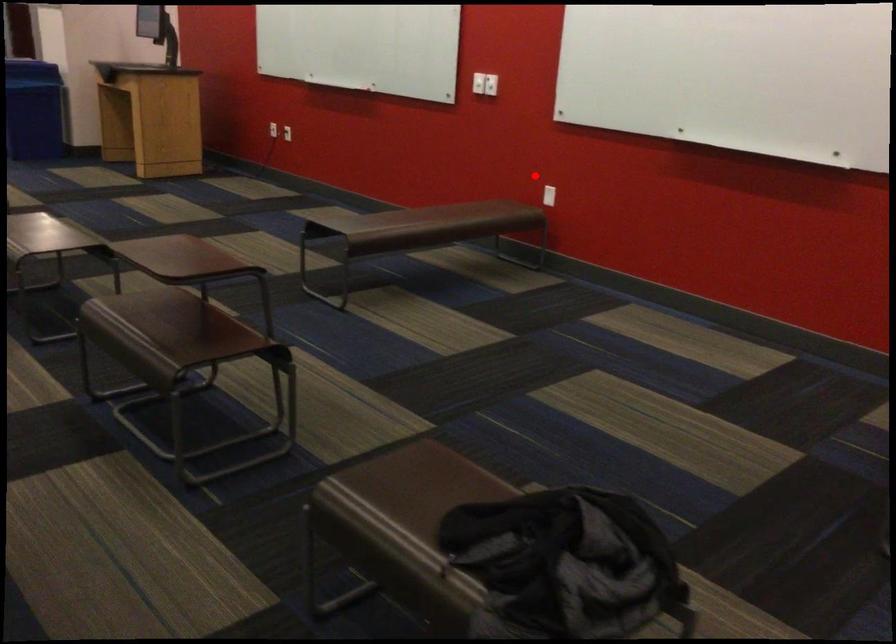
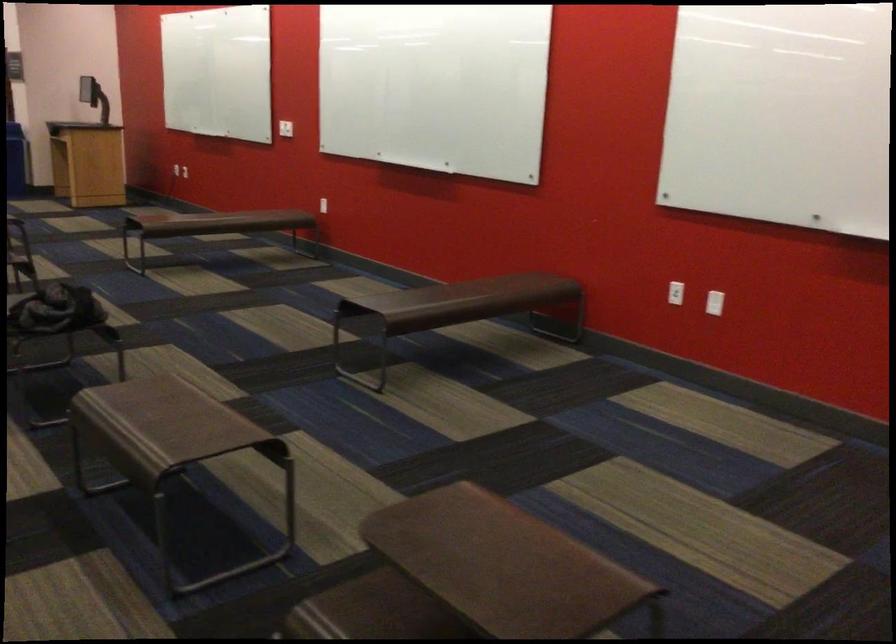
Question: I am providing you with two images of the same scene from different viewpoints. Given a red point in image1, look at the same physical point in image2. Is it:

Choices:
 (A) Closer to the viewpoint
 (B) Farther from the viewpoint

Answer: (B)